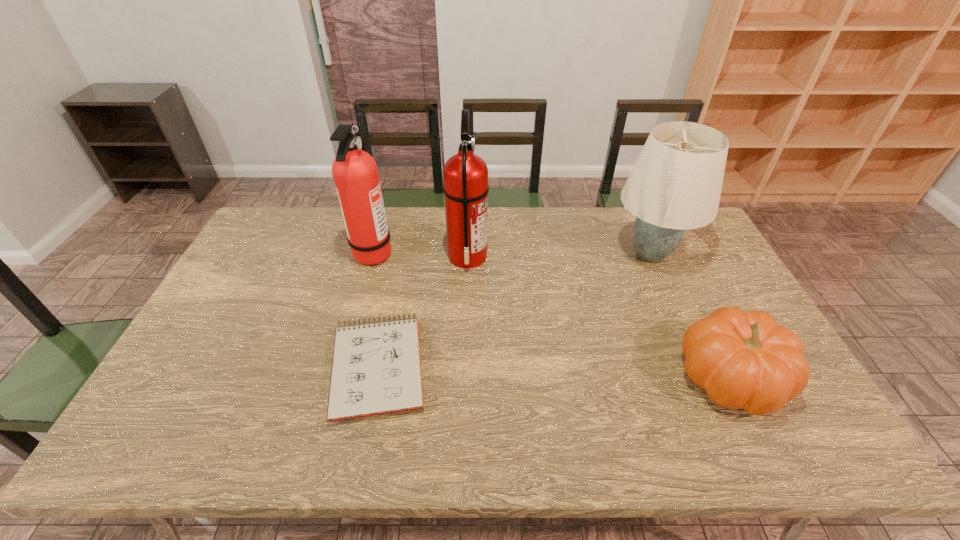
Where is `the left fire extinguisher`? Image resolution: width=960 pixels, height=540 pixels. the left fire extinguisher is located at coordinates (355, 173).

Where is `the right fire extinguisher`? The height and width of the screenshot is (540, 960). the right fire extinguisher is located at coordinates (465, 175).

Identify the location of lampshade. The width and height of the screenshot is (960, 540). (676, 182).

Image resolution: width=960 pixels, height=540 pixels. Find the location of `pumpkin`. pumpkin is located at coordinates (744, 360).

Locate an element on the screen. notepad is located at coordinates (376, 368).

Where is `vacant space situated on the handle side of the left fire extinguisher`? vacant space situated on the handle side of the left fire extinguisher is located at coordinates (429, 252).

At what (x,y) coordinates should I click in order to perform the action: click on blank space located 0.060m at the nozzle of the right fire extinguisher. Please return your answer as a coordinate pair (x, y). Image resolution: width=960 pixels, height=540 pixels. Looking at the image, I should click on (506, 256).

The image size is (960, 540). I want to click on vacant point located 0.270m on the front of the lampshade, so click(x=693, y=353).

Where is `vacant space located on the left of the second shortest object`? The image size is (960, 540). vacant space located on the left of the second shortest object is located at coordinates (548, 377).

What are the coordinates of `vacant area located on the back of the notepad` in the screenshot? It's located at (394, 294).